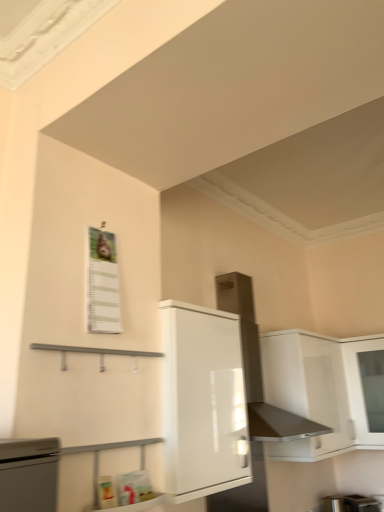
Question: Based on their positions, is white glossy cabinet at center, which is the 1th cabinetry in left-to-right order, located to the left or right of satin silver exhaust hood at upper center?

Choices:
 (A) left
 (B) right

Answer: (A)

Question: Looking at their shapes, would you say white glossy cabinet at center, which is counted as the second cabinetry, starting from the back, is wider or thinner than satin silver exhaust hood at upper center?

Choices:
 (A) wide
 (B) thin

Answer: (B)

Question: Considering the real-world distances, which object is farthest from the metallic silver toaster at lower right?

Choices:
 (A) satin silver exhaust hood at upper center
 (B) white glossy cabinet at center, which is the 1th cabinetry in left-to-right order
 (C) white glossy cabinet at upper right, the 2th cabinetry in the left-to-right sequence

Answer: (B)

Question: Which is farther from the satin silver exhaust hood at upper center?

Choices:
 (A) white glossy cabinet at center, which is counted as the first cabinetry, starting from the front
 (B) white glossy cabinet at upper right, positioned as the second cabinetry in front-to-back order
 (C) metallic silver toaster at lower right

Answer: (C)